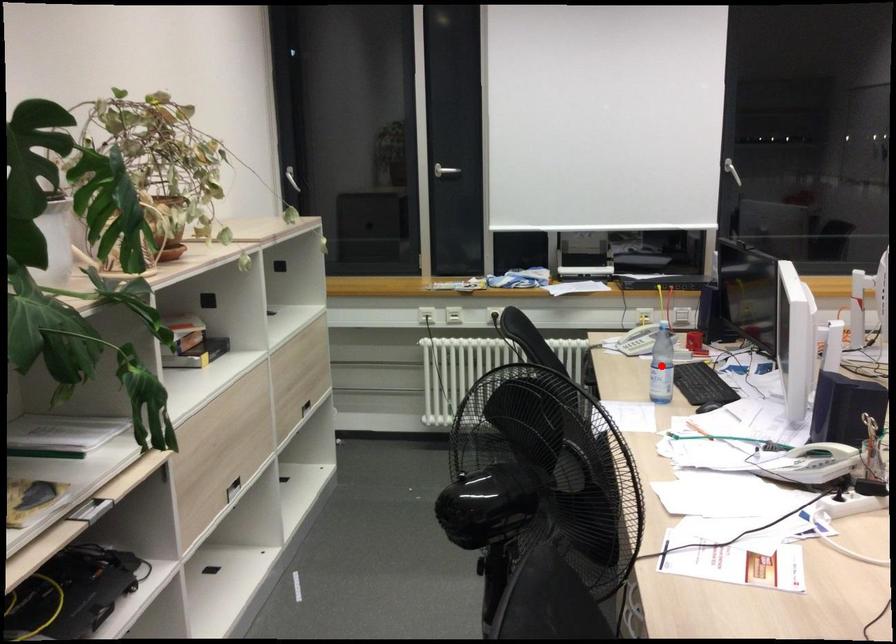
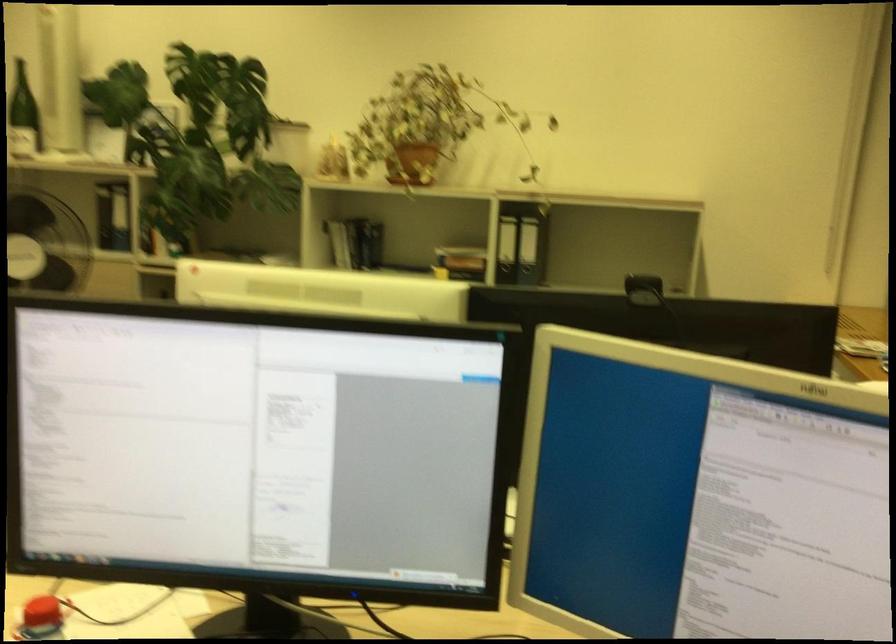
Question: I am providing you with two images of the same scene from different viewpoints. A red point is marked on the first image. At the location where the point appears in image 1, is it still visible in image 2?

Choices:
 (A) Yes
 (B) No

Answer: (B)